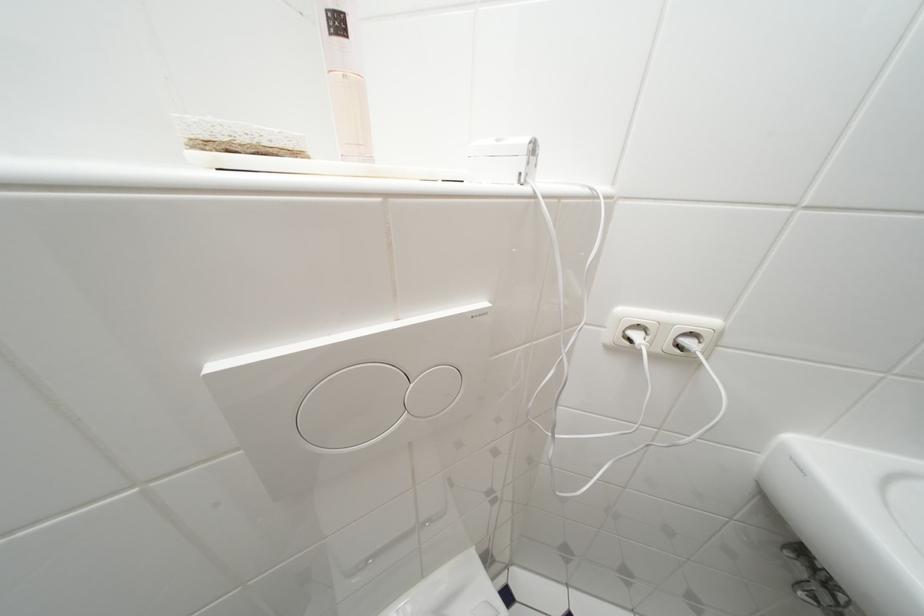
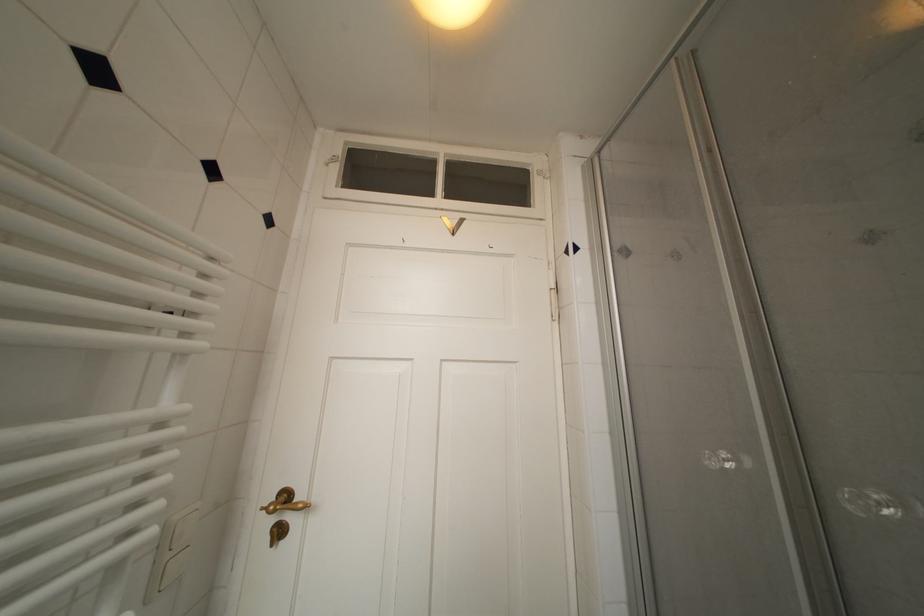
Question: The camera is either moving clockwise (left) or counter-clockwise (right) around the object. The first image is from the beginning of the video and the second image is from the end. Is the camera moving left or right when shooting the video?

Choices:
 (A) Left
 (B) Right

Answer: (A)